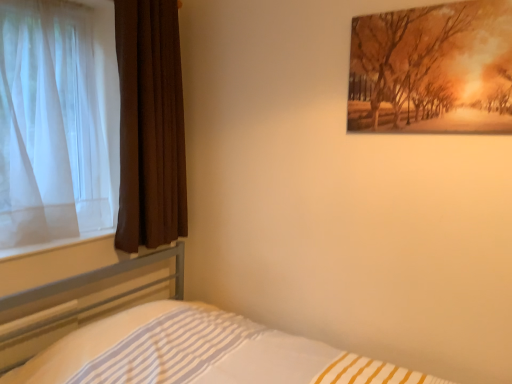
Question: Does white striped fabric at lower left turn towards matte orange painting at upper right?

Choices:
 (A) no
 (B) yes

Answer: (A)

Question: Can you confirm if white striped fabric at lower left is wider than matte orange painting at upper right?

Choices:
 (A) no
 (B) yes

Answer: (B)

Question: Considering the relative sizes of white striped fabric at lower left and matte orange painting at upper right in the image provided, is white striped fabric at lower left smaller than matte orange painting at upper right?

Choices:
 (A) yes
 (B) no

Answer: (B)

Question: Is white striped fabric at lower left placed right next to matte orange painting at upper right?

Choices:
 (A) yes
 (B) no

Answer: (B)

Question: Considering the relative positions of white striped fabric at lower left and matte orange painting at upper right in the image provided, is white striped fabric at lower left to the left of matte orange painting at upper right from the viewer's perspective?

Choices:
 (A) no
 (B) yes

Answer: (B)

Question: Considering the relative sizes of white striped fabric at lower left and matte orange painting at upper right in the image provided, is white striped fabric at lower left shorter than matte orange painting at upper right?

Choices:
 (A) no
 (B) yes

Answer: (A)

Question: Is white sheer curtain at left, which is counted as the 2th curtain, starting from the right, positioned in front of white striped fabric at lower left?

Choices:
 (A) no
 (B) yes

Answer: (A)

Question: Is white sheer curtain at left, which is counted as the 2th curtain, starting from the right, oriented towards white striped fabric at lower left?

Choices:
 (A) yes
 (B) no

Answer: (B)

Question: Is white striped fabric at lower left a part of white sheer curtain at left, which is counted as the 2th curtain, starting from the right?

Choices:
 (A) no
 (B) yes

Answer: (A)

Question: From the image's perspective, is white sheer curtain at left, the 1th curtain when ordered from left to right, on top of white striped fabric at lower left?

Choices:
 (A) yes
 (B) no

Answer: (A)

Question: Is white sheer curtain at left, the 1th curtain when ordered from left to right, located outside white striped fabric at lower left?

Choices:
 (A) no
 (B) yes

Answer: (B)

Question: Considering the relative sizes of white sheer curtain at left, which is counted as the 2th curtain, starting from the right, and white striped fabric at lower left in the image provided, is white sheer curtain at left, which is counted as the 2th curtain, starting from the right, smaller than white striped fabric at lower left?

Choices:
 (A) yes
 (B) no

Answer: (A)

Question: Is matte orange painting at upper right behind white striped fabric at lower left?

Choices:
 (A) no
 (B) yes

Answer: (B)